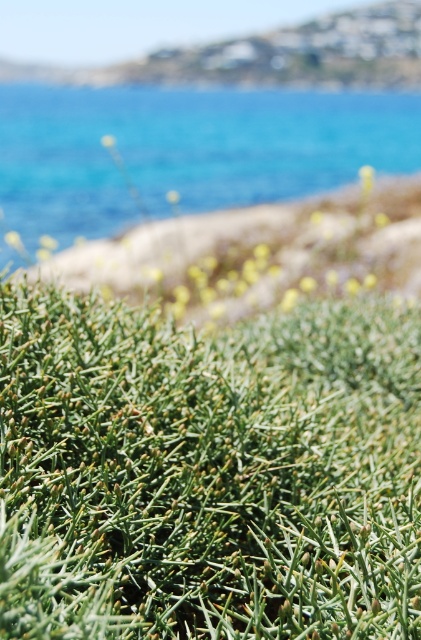
You are standing in a natural landscape and see the blue water at upper center and the green spiky plant at lower center. Which object takes up more horizontal space in the image?

The blue water at upper center takes up more horizontal space because its width is larger than the green spiky plant at lower center.

You are standing in a natural landscape and want to take a photo of the blue water at upper center and the green spiky plant at lower center. Which object is closer to you?

The blue water at upper center is closer to you because it is further to the viewer than the green spiky plant at lower center.